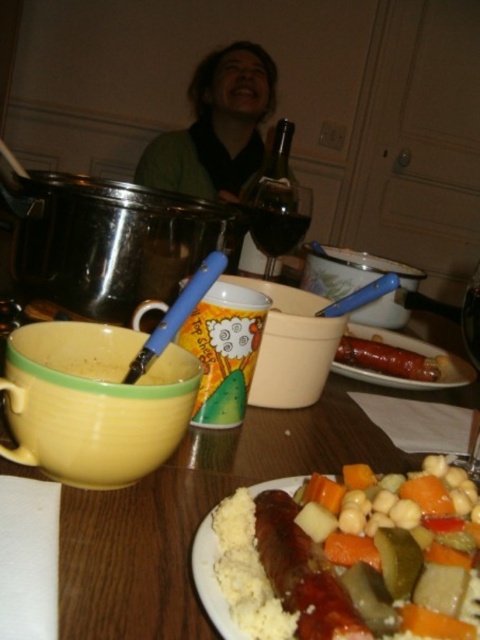
Question: Which point is farther to the camera?

Choices:
 (A) (272, 291)
 (B) (466, 342)
 (C) (381, 372)
 (D) (273, 227)

Answer: (D)

Question: Can you confirm if matte white plate with mixed vegetables and sausage at center is wider than dark glass wine at center?

Choices:
 (A) no
 (B) yes

Answer: (B)

Question: Considering the relative positions of green matte shirt at upper center and transparent glass wine glass at center in the image provided, where is green matte shirt at upper center located with respect to transparent glass wine glass at center?

Choices:
 (A) right
 (B) left

Answer: (B)

Question: Which point is closer to the camera taking this photo?

Choices:
 (A) (224, 76)
 (B) (291, 225)
 (C) (465, 332)
 (D) (448, 387)

Answer: (C)

Question: Which object appears closest to the camera in this image?

Choices:
 (A) green matte shirt at upper center
 (B) sausage and vegetables at center
 (C) transparent glass wine at center

Answer: (C)

Question: Is sausage and vegetables at center positioned behind transparent glass at upper center?

Choices:
 (A) yes
 (B) no

Answer: (A)